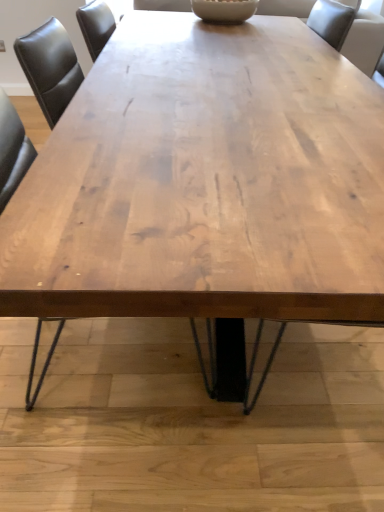
Describe the element at coordinates (224, 10) in the screenshot. I see `matte beige bowl at center` at that location.

In order to face matte beige bowl at center, should I rotate leftwards or rightwards?

It's best to rotate right around 4.110 degrees.

At what (x,y) coordinates should I click in order to perform the action: click on matte beige bowl at center. Please return your answer as a coordinate pair (x, y). Image resolution: width=384 pixels, height=512 pixels. Looking at the image, I should click on (224, 10).

What are the coordinates of `matte beige bowl at center` in the screenshot? It's located at [x=224, y=10].